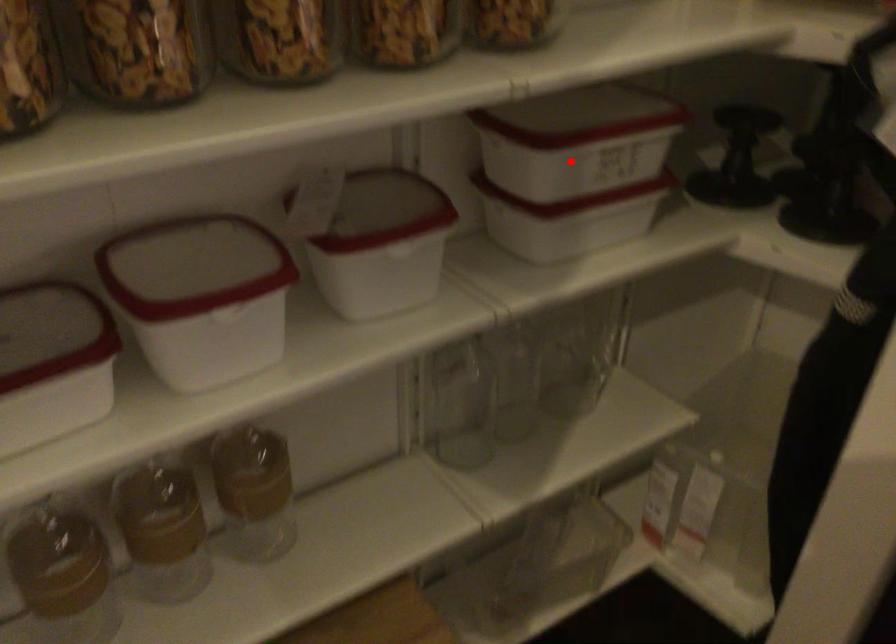
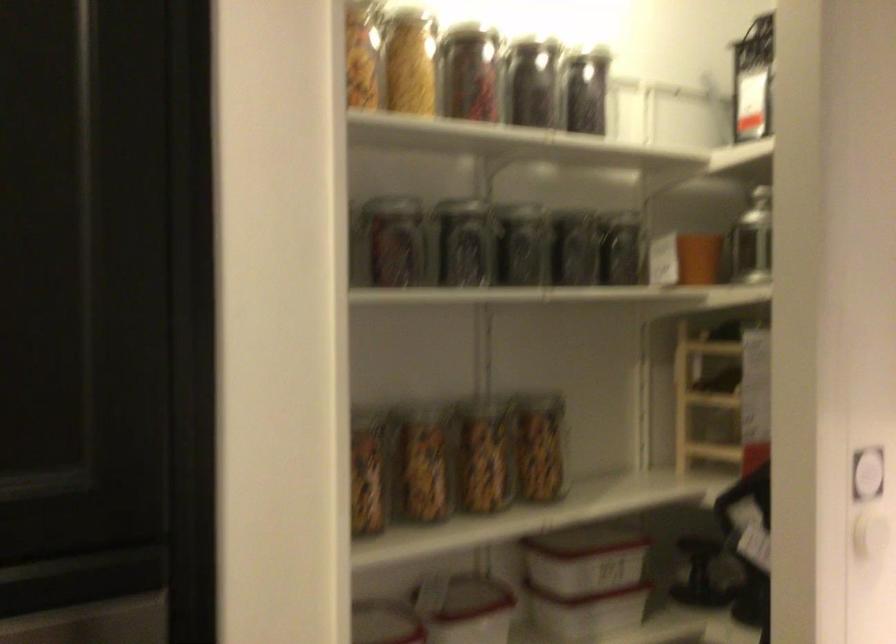
Question: I am providing you with two images of the same scene from different viewpoints. Given a red point in image1, look at the same physical point in image2. Is it:

Choices:
 (A) Closer to the viewpoint
 (B) Farther from the viewpoint

Answer: (B)